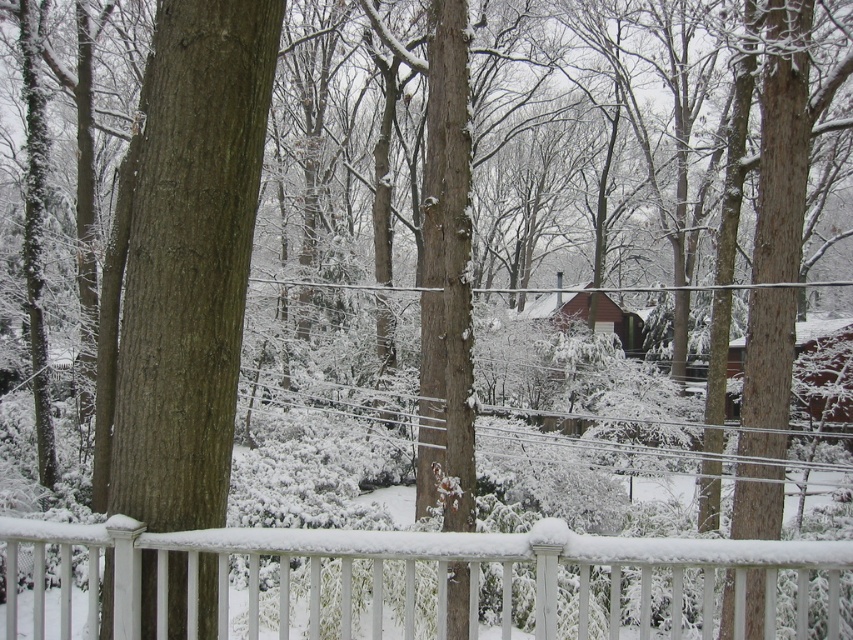
Is white painted wood rail at lower center thinner than brown rough bark tree at left?

In fact, white painted wood rail at lower center might be wider than brown rough bark tree at left.

Consider the image. Is white painted wood rail at lower center in front of brown rough bark tree at left?

Yes, white painted wood rail at lower center is closer to the viewer.

Find the location of a particular element. white painted wood rail at lower center is located at coordinates (415, 582).

Identify the location of white painted wood rail at lower center. The image size is (853, 640). (415, 582).